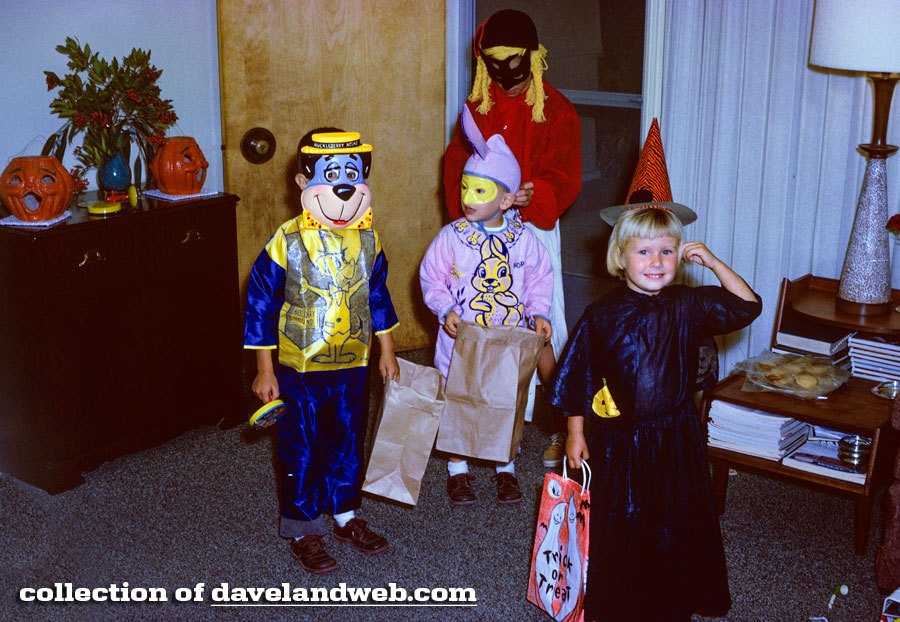
Image resolution: width=900 pixels, height=622 pixels. I want to click on table, so click(841, 418).